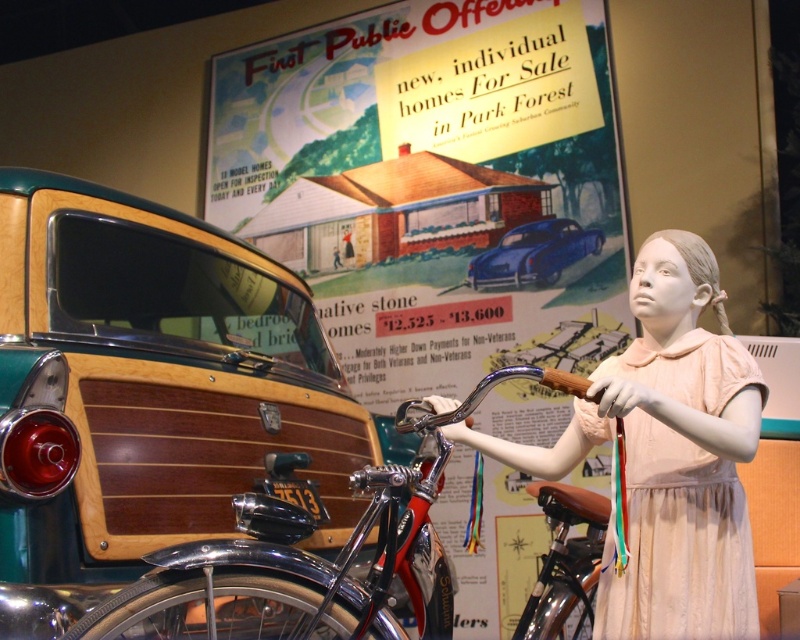
You are a museum curator planning to move the shiny chrome bicycle at center and the shiny blue car at center to a new exhibition hall. The entrance of the new hall has a doorway that is 1.8 meters wide. Can both items pass through the doorway if moved individually?

The shiny chrome bicycle at center might be wider than the shiny blue car at center. Since the doorway is 1.8 meters wide, it is uncertain whether both items can pass through individually without knowing their exact widths. Further measurements are needed.

You are a museum guide explaining the layout of the exhibit. You mention the shiny chrome bicycle at center and the vintage car with a wooden panel design on its rear section. Which vehicle is positioned closer to the right side of the display?

The shiny chrome bicycle at center is located at point [316,556], which is closer to the right side of the display compared to the vintage car with a wooden panel design on its rear section.

Consider the image. You are a museum visitor standing in front of the display. You want to take a photo of the wooden paneling at left and the shiny chrome bicycle at center. Which object should you focus on first if you want to capture both in a single frame without moving the camera?

You should focus on the wooden paneling at left first because it is positioned over the shiny chrome bicycle at center, meaning it is closer to the camera. By focusing on the closer object, both will be in focus if within the depth of field.